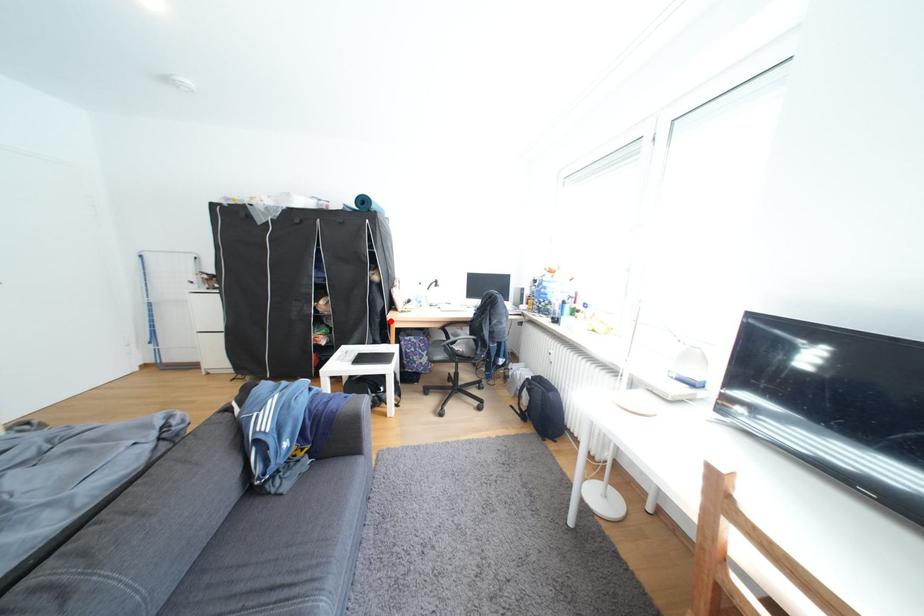
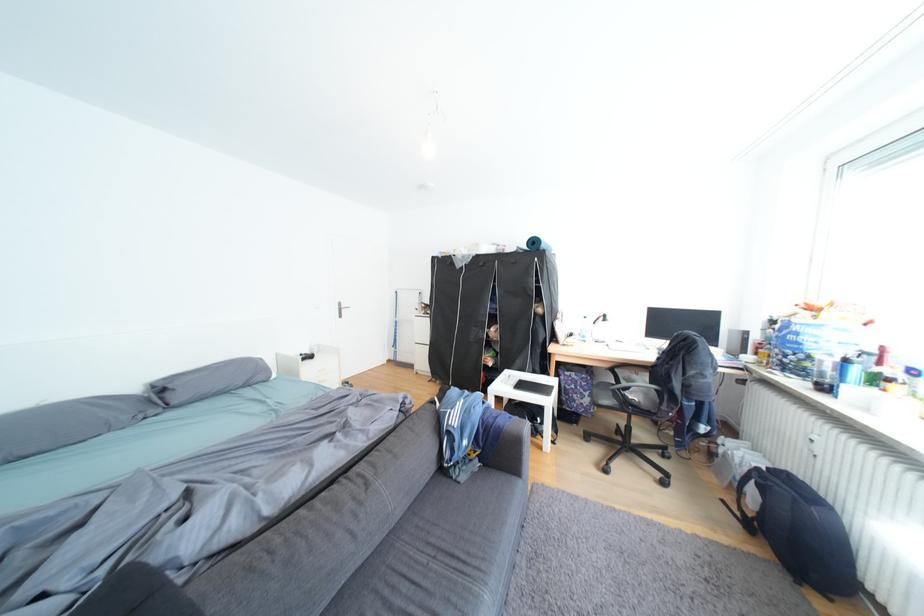
The point at the highlighted location is marked in the first image. Where is the corresponding point in the second image?

(552, 352)